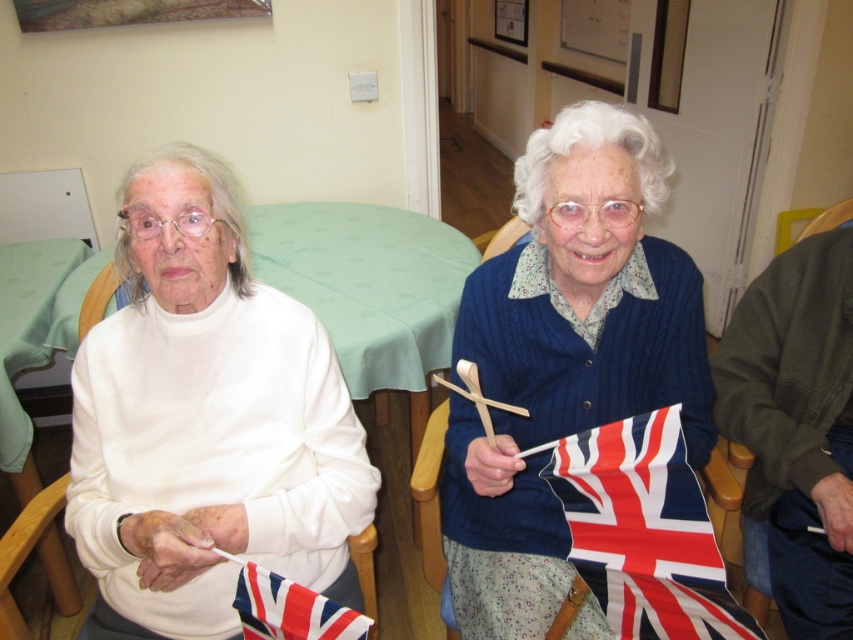
The width and height of the screenshot is (853, 640). What do you see at coordinates (206, 420) in the screenshot? I see `white matte turtleneck sweater at left` at bounding box center [206, 420].

Can you confirm if white matte turtleneck sweater at left is positioned below wooden chair at lower left?

No.

Is point (236, 445) farther from camera compared to point (0, 547)?

No, (236, 445) is in front of (0, 547).

Where is `white matte turtleneck sweater at left`? Image resolution: width=853 pixels, height=640 pixels. white matte turtleneck sweater at left is located at coordinates (206, 420).

Can you confirm if wooden chair at center is positioned to the left of wooden chair at lower left?

No, wooden chair at center is not to the left of wooden chair at lower left.

In the scene shown: Which is above, wooden chair at center or wooden chair at lower left?

wooden chair at center is above.

Locate an element on the screen. wooden chair at center is located at coordinates (643, 531).

The width and height of the screenshot is (853, 640). Find the location of `wooden chair at center`. wooden chair at center is located at coordinates (643, 531).

Is white cotton sweater at left smaller than union jack fabric flag at lower left?

Incorrect, white cotton sweater at left is not smaller in size than union jack fabric flag at lower left.

Does point (665, 301) lie in front of point (329, 624)?

No, (665, 301) is behind (329, 624).

This screenshot has height=640, width=853. What do you see at coordinates (564, 356) in the screenshot? I see `white cotton sweater at left` at bounding box center [564, 356].

Locate an element on the screen. white cotton sweater at left is located at coordinates (564, 356).